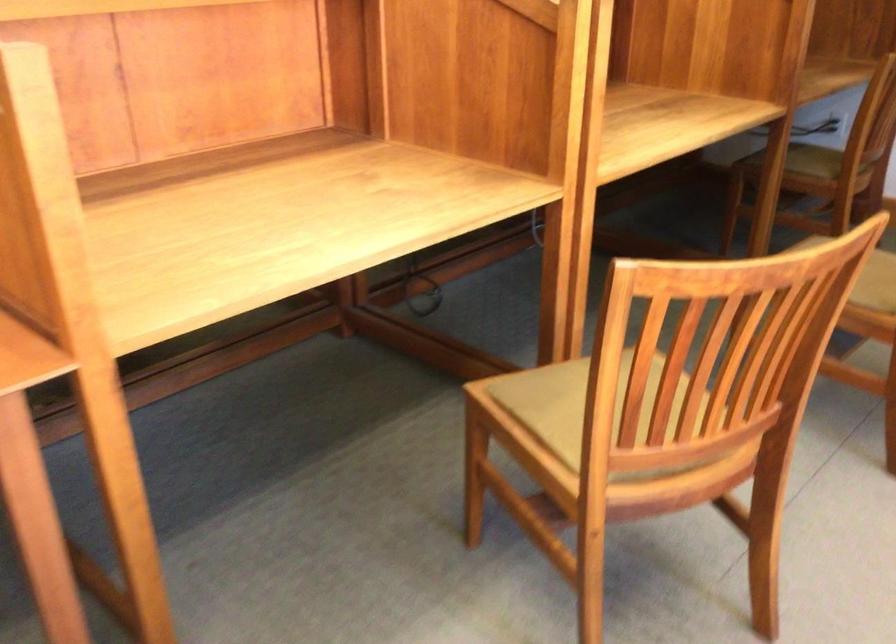
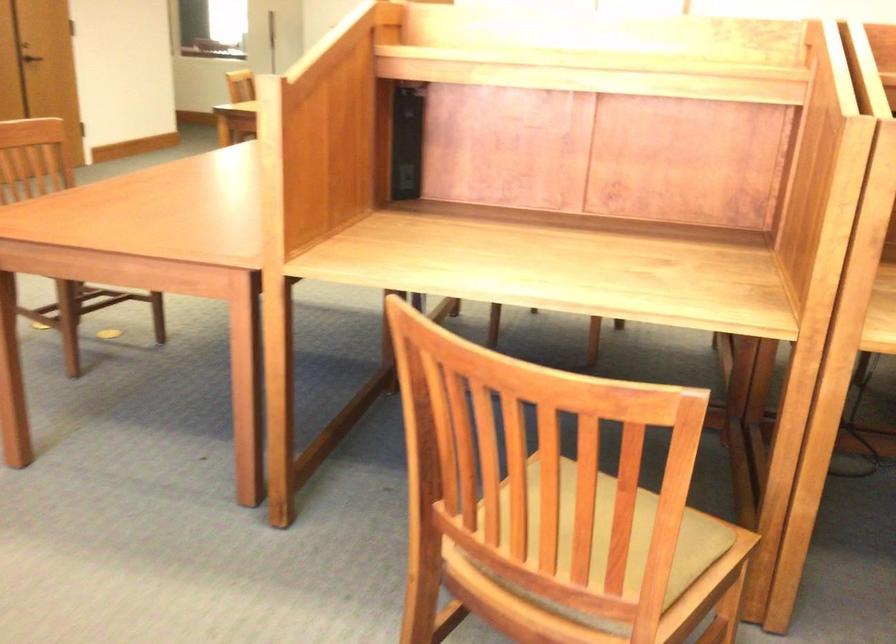
Locate, in the second image, the point that corresponds to point (798, 375) in the first image.

(651, 565)